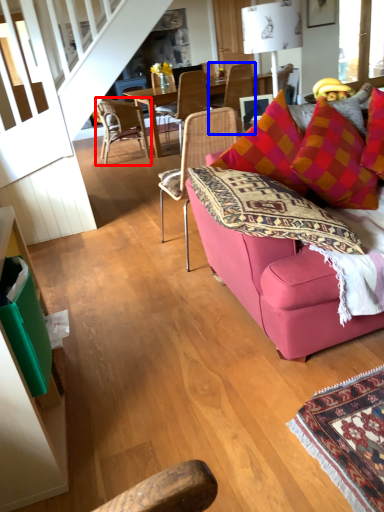
Question: Which point is further to the camera, chair (highlighted by a red box) or chair (highlighted by a blue box)?

Choices:
 (A) chair
 (B) chair

Answer: (B)